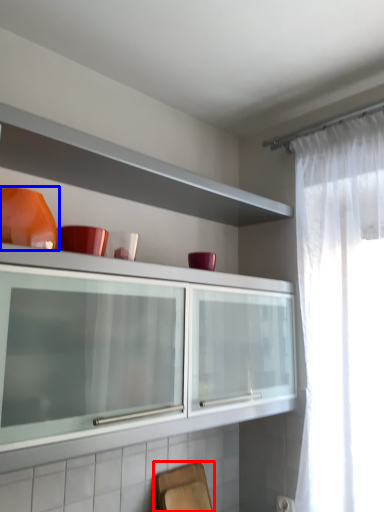
Question: Which of the following is the closest to the observer, chair (highlighted by a red box) or tableware (highlighted by a blue box)?

Choices:
 (A) chair
 (B) tableware

Answer: (B)